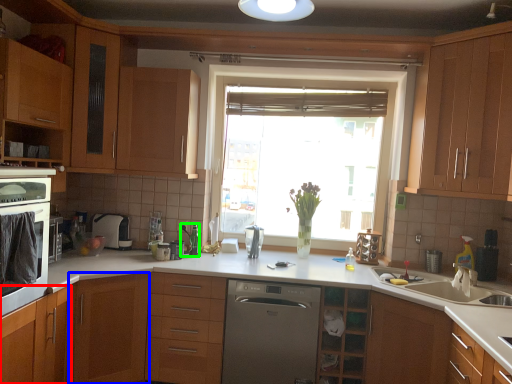
Question: Based on their relative distances, which object is farther from cabinetry (highlighted by a red box)? Choose from cabinetry (highlighted by a blue box) and faucet (highlighted by a green box).

Choices:
 (A) cabinetry
 (B) faucet

Answer: (B)